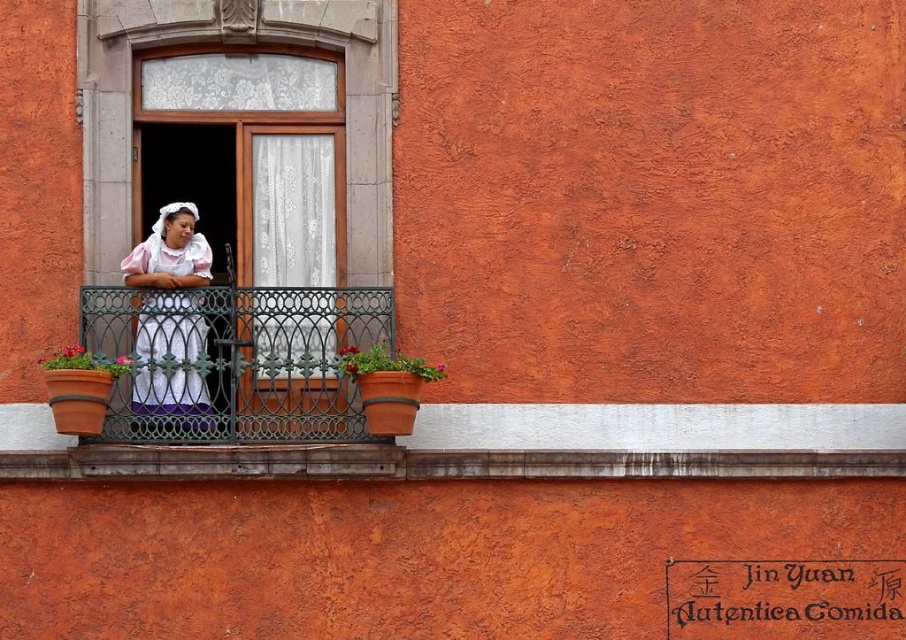
You are a fashion designer who wants to create a new line of clothing inspired by the scene. You notice the white cotton dress at center and the terracotta clay pot at left. Which item is narrower in width?

The white cotton dress at center is thinner than the terracotta clay pot at left, so the white cotton dress at center is narrower in width.

You are standing on the balcony and want to place a small potted plant between the two points labeled point (161,310) and point (150,356). Which point should the plant be closer to if it needs to be closer to the front of the balcony?

The plant should be closer to point (150,356) because point (161,310) is behind it, meaning point (150,356) is closer to the front of the balcony.

You are standing in front of the orange wall and see the green wrought iron balcony at center marked by point (234, 360). If you want to reach the balcony, which direction should you move relative to the orange wall?

The green wrought iron balcony at center is located at point (234, 360), so you should move towards that coordinate to reach it.